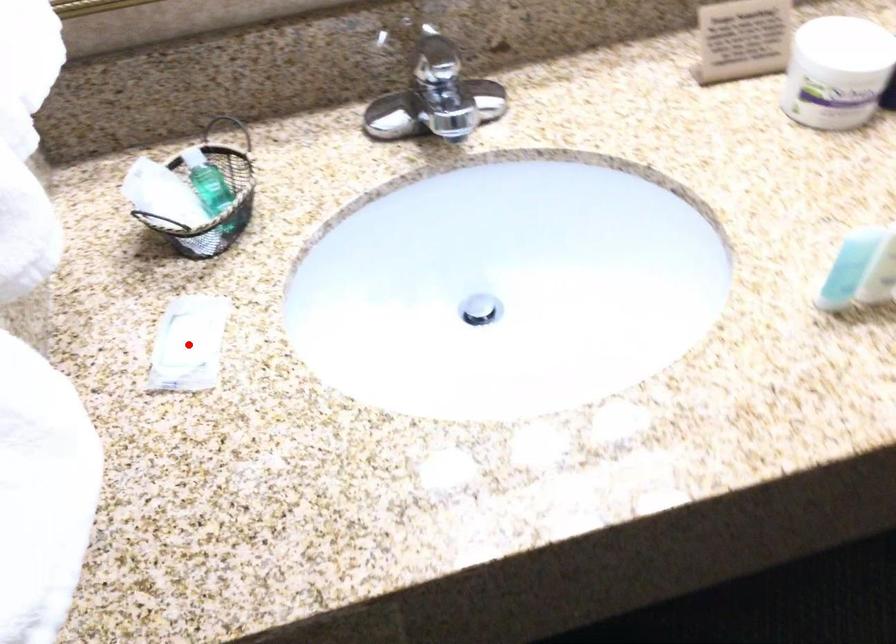
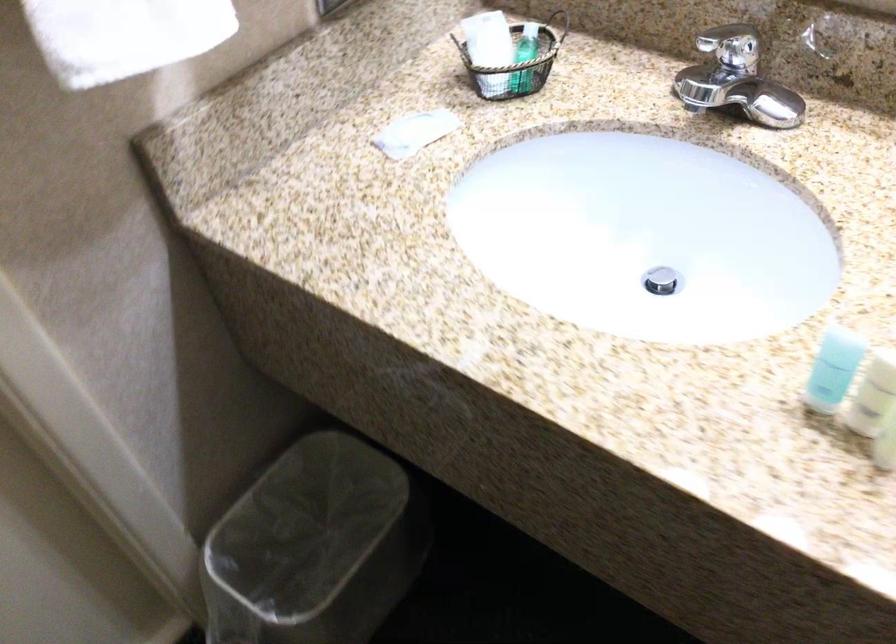
Question: I am providing you with two images of the same scene from different viewpoints. Image1 has a red point marked. In image2, the corresponding 3D location appears at what relative position? Reply with the corresponding letter.

Choices:
 (A) Closer
 (B) Farther

Answer: (B)